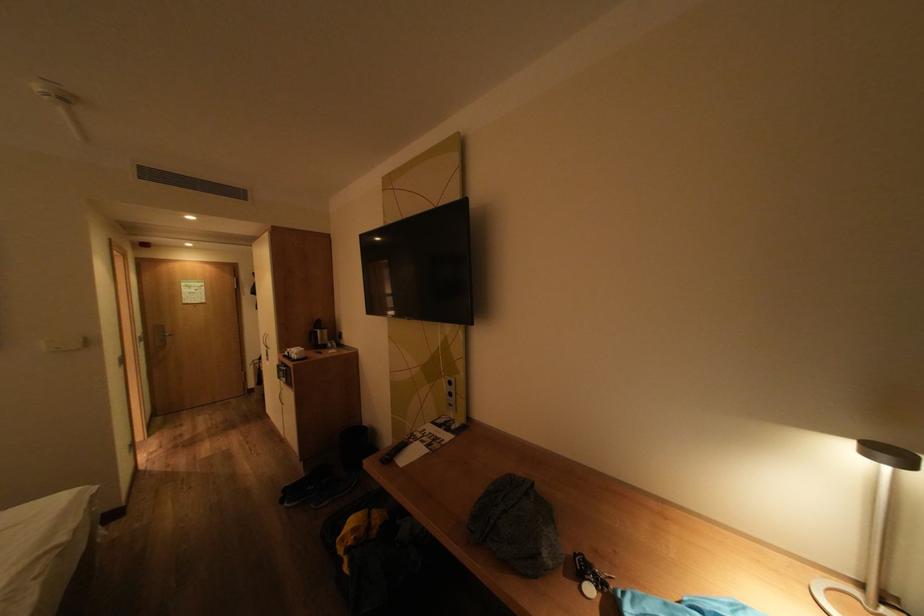
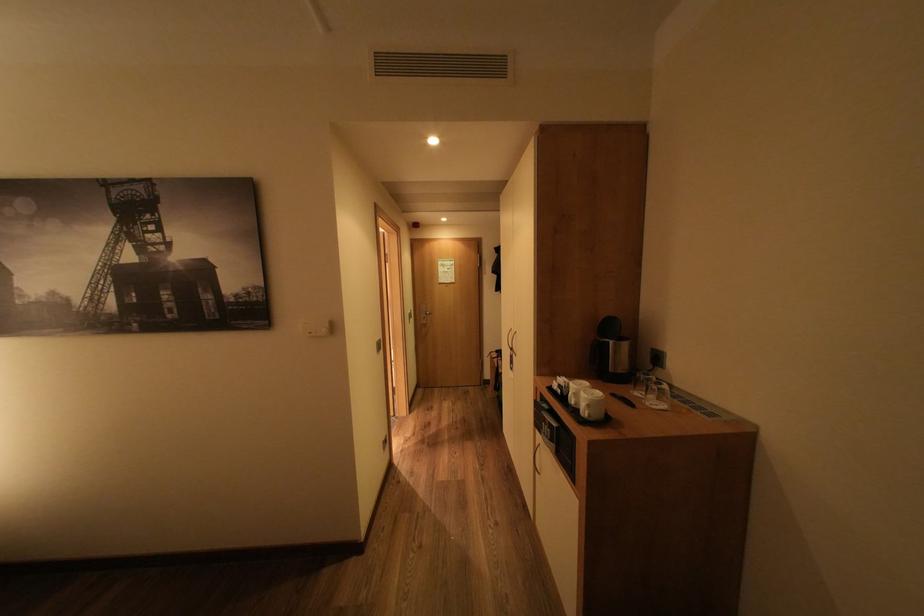
The point at (343,352) is marked in the first image. Where is the corresponding point in the second image?

(664, 402)